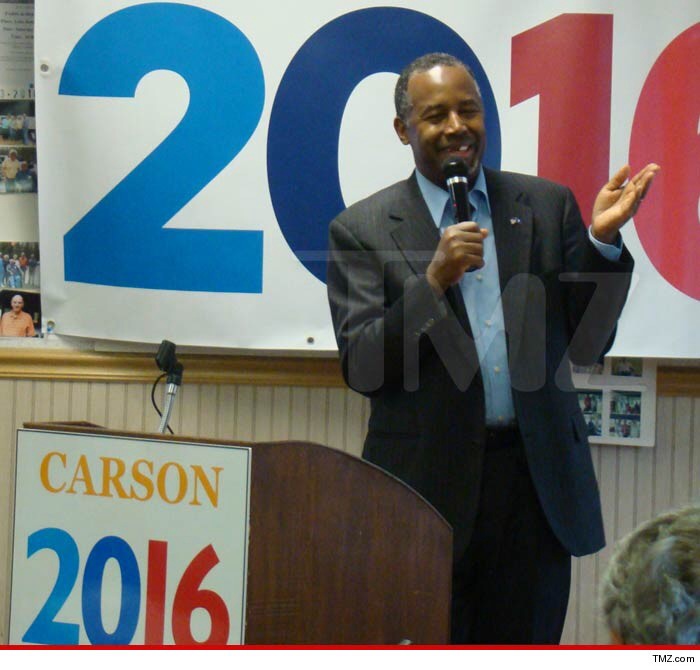
Locate an element on the screen. This screenshot has width=700, height=670. photos is located at coordinates (29, 315), (36, 273), (24, 181), (7, 125), (631, 395).